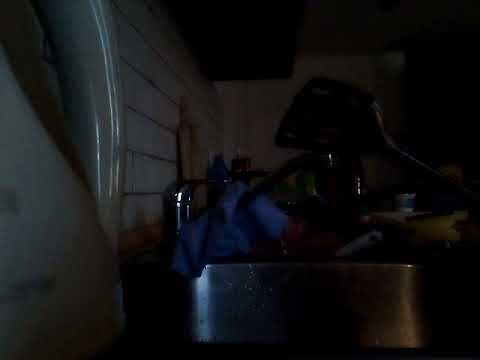
Locate an element on the screen. Image resolution: width=480 pixels, height=360 pixels. cabinet is located at coordinates (248, 37).